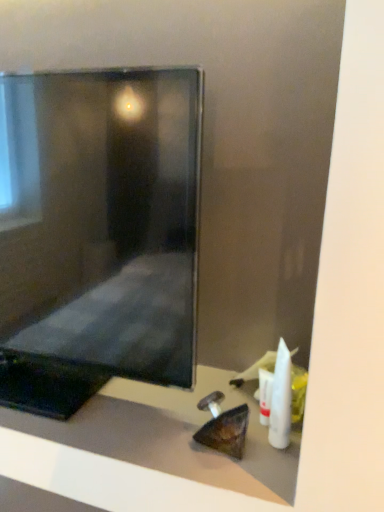
This screenshot has height=512, width=384. Identify the location of free space in front of white plastic tube at lower right, placed as the 1th toiletry when sorted from back to front. (253, 469).